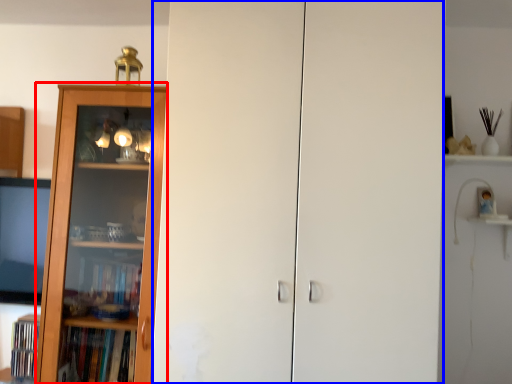
Question: Which object appears farthest to the camera in this image, bookcase (highlighted by a red box) or screen door (highlighted by a blue box)?

Choices:
 (A) bookcase
 (B) screen door

Answer: (A)